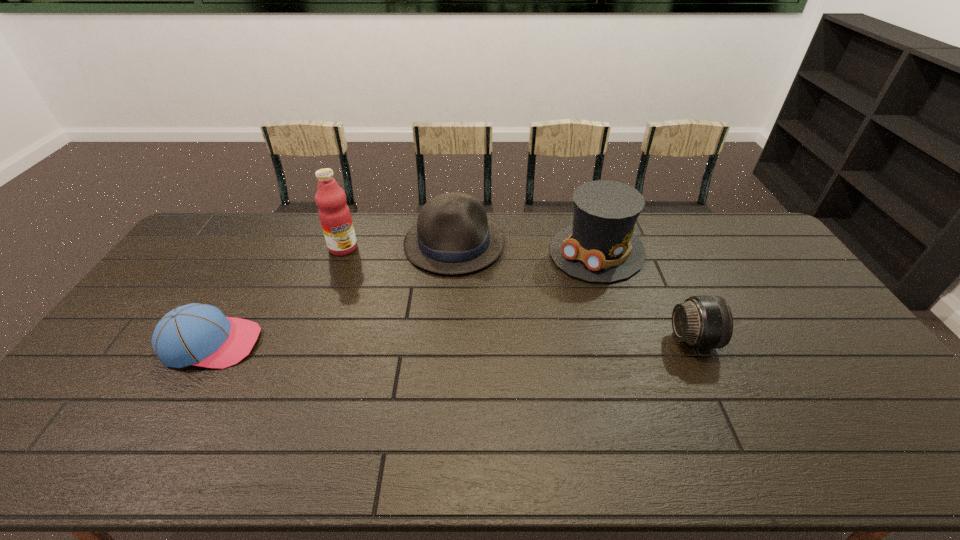
Where is `free spot between the third tallest object and the second object from left to right`? free spot between the third tallest object and the second object from left to right is located at coordinates pos(398,246).

Find the location of a particular element. This screenshot has width=960, height=540. free space between the telephoto lens and the third object from left to right is located at coordinates (574, 292).

The height and width of the screenshot is (540, 960). In order to click on blank region between the shortest object and the dress hat in this screenshot , I will do `click(404, 298)`.

You are a GUI agent. You are given a task and a screenshot of the screen. Output one action in this format:
    pyautogui.click(x=<x>, y=<y>)
    Task: Click on the free point between the tallest object and the bowler hat
    Image resolution: width=960 pixels, height=540 pixels.
    Given the screenshot: What is the action you would take?
    pyautogui.click(x=398, y=246)

This screenshot has width=960, height=540. Identify the location of free area in between the fourth shortest object and the telephoto lens. (645, 295).

Locate an element on the screen. The width and height of the screenshot is (960, 540). empty location between the shortest object and the dress hat is located at coordinates (404, 298).

The width and height of the screenshot is (960, 540). What are the coordinates of `vacant area that lies between the bowler hat and the telephoto lens` in the screenshot? It's located at (574, 292).

Image resolution: width=960 pixels, height=540 pixels. Identify the location of empty space that is in between the fourth shortest object and the telephoto lens. (645, 295).

Identify which object is the nearest to the dress hat. Please provide its 2D coordinates. Your answer should be formatted as a tuple, i.e. [(x, y)], where the tuple contains the x and y coordinates of a point satisfying the conditions above.

[(452, 235)]

Identify which object is the second nearest to the bowler hat. Please provide its 2D coordinates. Your answer should be formatted as a tuple, i.e. [(x, y)], where the tuple contains the x and y coordinates of a point satisfying the conditions above.

[(334, 214)]